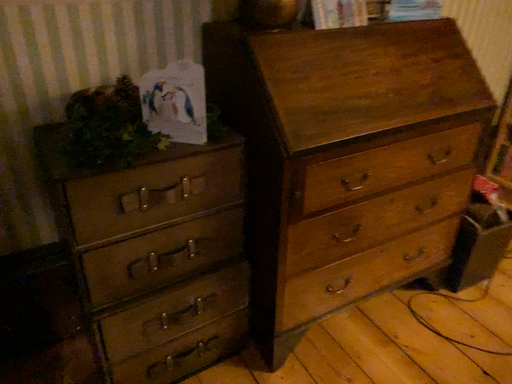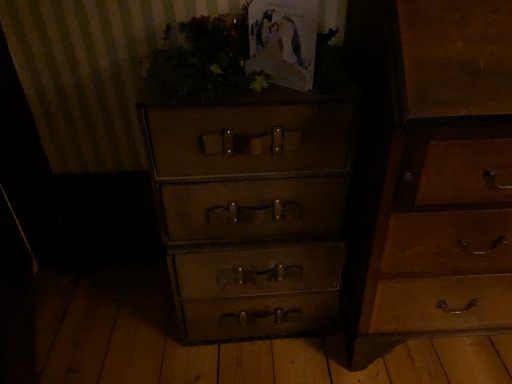
Question: Which way did the camera rotate in the video?

Choices:
 (A) rotated left
 (B) rotated right

Answer: (A)